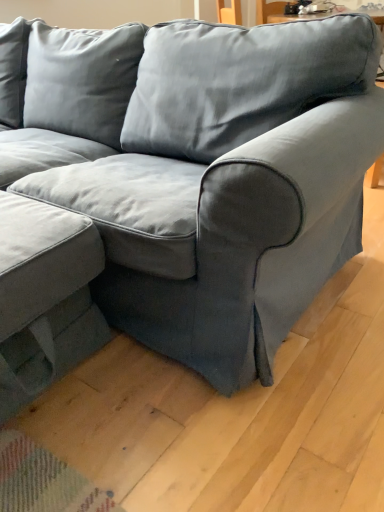
This screenshot has width=384, height=512. Describe the element at coordinates (44, 296) in the screenshot. I see `suede gray swivel chair at lower left` at that location.

Where is `suede gray swivel chair at lower left`? This screenshot has height=512, width=384. suede gray swivel chair at lower left is located at coordinates (44, 296).

Locate an element on the screen. The width and height of the screenshot is (384, 512). suede gray swivel chair at lower left is located at coordinates (44, 296).